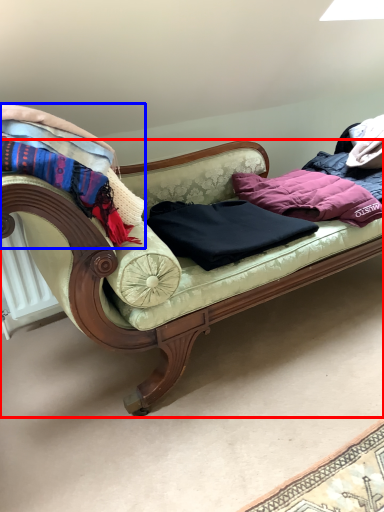
Question: Which point is closer to the camera, studio couch (highlighted by a red box) or blanket (highlighted by a blue box)?

Choices:
 (A) studio couch
 (B) blanket

Answer: (A)